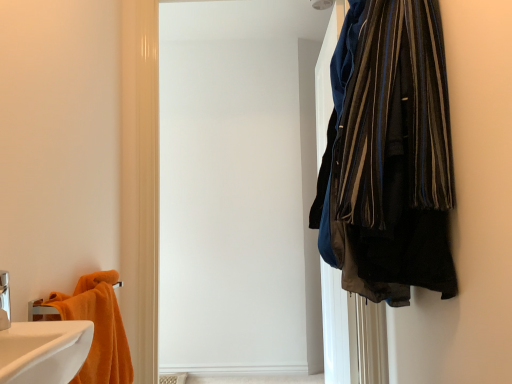
What do you see at coordinates (98, 328) in the screenshot? The image size is (512, 384). I see `orange cotton towel at lower left` at bounding box center [98, 328].

Where is `orange cotton towel at lower left`? Image resolution: width=512 pixels, height=384 pixels. orange cotton towel at lower left is located at coordinates (98, 328).

Between orange cotton towel at lower left and white glossy sink at lower left, which one has larger width?

With larger width is white glossy sink at lower left.

Which object is positioned more to the left, orange cotton towel at lower left or white glossy sink at lower left?

From the viewer's perspective, orange cotton towel at lower left appears more on the left side.

From a real-world perspective, is orange cotton towel at lower left physically located above or below white glossy sink at lower left?

orange cotton towel at lower left is situated lower than white glossy sink at lower left in the real world.

Is white glossy sink at lower left inside the boundaries of orange cotton towel at lower left, or outside?

white glossy sink at lower left lies outside orange cotton towel at lower left.

Is point (77, 325) closer to camera compared to point (121, 325)?

Yes, it is.

In the scene shown: Is white glossy sink at lower left not close to orange cotton towel at lower left?

No, white glossy sink at lower left is not far from orange cotton towel at lower left.

Could you tell me if white glossy sink at lower left is facing orange cotton towel at lower left?

No.

In the scene shown: From the image's perspective, which one is positioned lower, white matte screen door at upper right or white glossy sink at lower left?

white glossy sink at lower left is shown below in the image.

In terms of height, does white matte screen door at upper right look taller or shorter compared to white glossy sink at lower left?

white matte screen door at upper right is taller than white glossy sink at lower left.

From a real-world perspective, between white matte screen door at upper right and white glossy sink at lower left, who is vertically lower?

white glossy sink at lower left, from a real-world perspective.

From a real-world perspective, between white matte screen door at upper right and orange cotton towel at lower left, who is vertically higher?

white matte screen door at upper right.

Would you say white matte screen door at upper right is inside or outside orange cotton towel at lower left?

white matte screen door at upper right is not inside orange cotton towel at lower left, it's outside.

From the image's perspective, is white matte screen door at upper right on top of orange cotton towel at lower left?

Yes, from the image's perspective, white matte screen door at upper right is above orange cotton towel at lower left.

Does white glossy sink at lower left come in front of white matte screen door at upper right?

Yes, it is.

Who is bigger, white glossy sink at lower left or white matte screen door at upper right?

white matte screen door at upper right is bigger.

Is white glossy sink at lower left shorter than white matte screen door at upper right?

Yes.

Considering the sizes of objects orange cotton towel at lower left and white matte screen door at upper right in the image provided, who is taller, orange cotton towel at lower left or white matte screen door at upper right?

white matte screen door at upper right is taller.

From a real-world perspective, is orange cotton towel at lower left physically below white matte screen door at upper right?

Correct, in the physical world, orange cotton towel at lower left is lower than white matte screen door at upper right.

Based on the photo, who is smaller, orange cotton towel at lower left or white matte screen door at upper right?

orange cotton towel at lower left.

Is point (94, 288) farther from viewer compared to point (266, 37)?

No.

Locate an element on the screen. towel beneath the white glossy sink at lower left (from a real-world perspective) is located at coordinates (98, 328).

Identify the location of towel on the left of the white glossy sink at lower left. (98, 328).

Which object lies further to the anchor point white glossy sink at lower left, white matte screen door at upper right or orange cotton towel at lower left?

white matte screen door at upper right is further to white glossy sink at lower left.

When comparing their distances from white glossy sink at lower left, does orange cotton towel at lower left or white matte screen door at upper right seem further?

white matte screen door at upper right lies further to white glossy sink at lower left than the other object.

Consider the image. Based on their spatial positions, is orange cotton towel at lower left or white glossy sink at lower left closer to white matte screen door at upper right?

orange cotton towel at lower left.

Looking at the image, which one is located closer to orange cotton towel at lower left, white matte screen door at upper right or white glossy sink at lower left?

white glossy sink at lower left.

Based on their spatial positions, is white glossy sink at lower left or orange cotton towel at lower left closer to white matte screen door at upper right?

orange cotton towel at lower left.

Estimate the real-world distances between objects in this image. Which object is further from orange cotton towel at lower left, white glossy sink at lower left or white matte screen door at upper right?

white matte screen door at upper right is positioned further to the anchor orange cotton towel at lower left.

Where is `towel between white glossy sink at lower left and white matte screen door at upper right along the z-axis`? The height and width of the screenshot is (384, 512). towel between white glossy sink at lower left and white matte screen door at upper right along the z-axis is located at coordinates (98, 328).